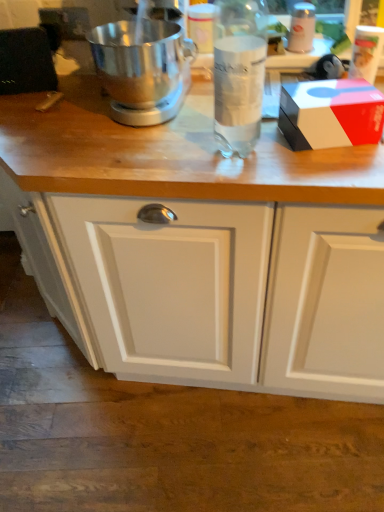
Question: From the image's perspective, does white glossy bottle at upper right, which ranks as the second bottle in left-to-right order, appear higher than clear glass bottle at center, positioned as the second bottle in back-to-front order?

Choices:
 (A) yes
 (B) no

Answer: (A)

Question: Is white glossy bottle at upper right, acting as the 2th bottle starting from the front, outside of clear glass bottle at center, which appears as the 1th bottle when viewed from the front?

Choices:
 (A) no
 (B) yes

Answer: (B)

Question: Is white glossy bottle at upper right, which ranks as the second bottle in left-to-right order, bigger than clear glass bottle at center, positioned as the second bottle in back-to-front order?

Choices:
 (A) yes
 (B) no

Answer: (B)

Question: From a real-world perspective, is white glossy bottle at upper right, marked as the first bottle in a right-to-left arrangement, over clear glass bottle at center, the second bottle in the right-to-left sequence?

Choices:
 (A) no
 (B) yes

Answer: (A)

Question: From a real-world perspective, is white glossy bottle at upper right, which is counted as the 1th bottle, starting from the back, positioned under clear glass bottle at center, the second bottle in the right-to-left sequence, based on gravity?

Choices:
 (A) no
 (B) yes

Answer: (B)

Question: Does white glossy bottle at upper right, marked as the first bottle in a right-to-left arrangement, have a lesser width compared to clear glass bottle at center, positioned as the second bottle in back-to-front order?

Choices:
 (A) no
 (B) yes

Answer: (B)

Question: Is white matte cabinet at lower center aimed at polished silver mixer at center?

Choices:
 (A) yes
 (B) no

Answer: (B)

Question: From a real-world perspective, is white matte cabinet at lower center beneath polished silver mixer at center?

Choices:
 (A) yes
 (B) no

Answer: (A)

Question: Is white matte cabinet at lower center at the right side of polished silver mixer at center?

Choices:
 (A) no
 (B) yes

Answer: (A)

Question: Considering the relative positions of white matte cabinet at lower center and polished silver mixer at center in the image provided, is white matte cabinet at lower center to the left of polished silver mixer at center from the viewer's perspective?

Choices:
 (A) yes
 (B) no

Answer: (A)

Question: Is white matte cabinet at lower center directly adjacent to polished silver mixer at center?

Choices:
 (A) yes
 (B) no

Answer: (B)

Question: From the image's perspective, is white matte cabinet at lower center above polished silver mixer at center?

Choices:
 (A) no
 (B) yes

Answer: (A)

Question: From a real-world perspective, is white glossy bottle at upper right, which ranks as the second bottle in left-to-right order, positioned over polished silver mixer at center based on gravity?

Choices:
 (A) no
 (B) yes

Answer: (A)